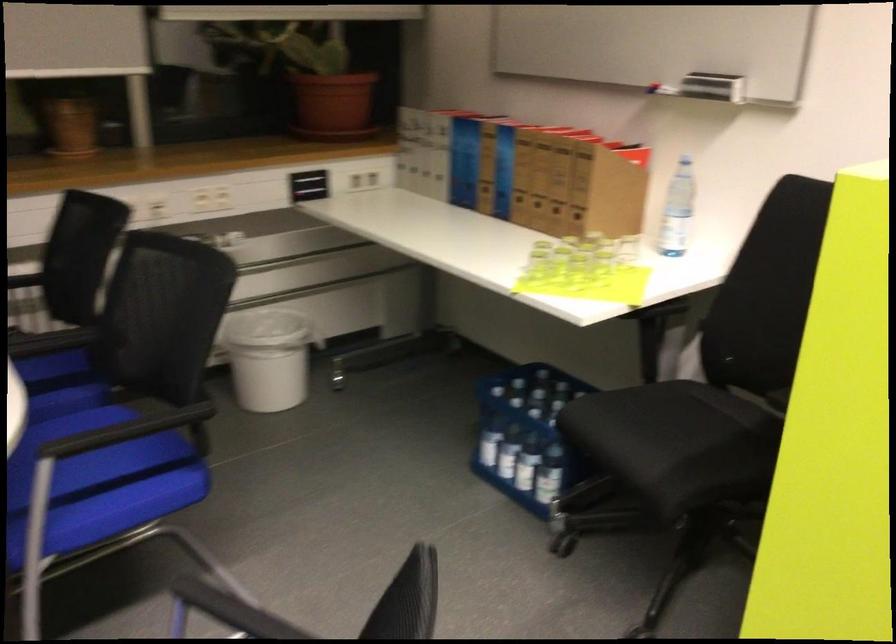
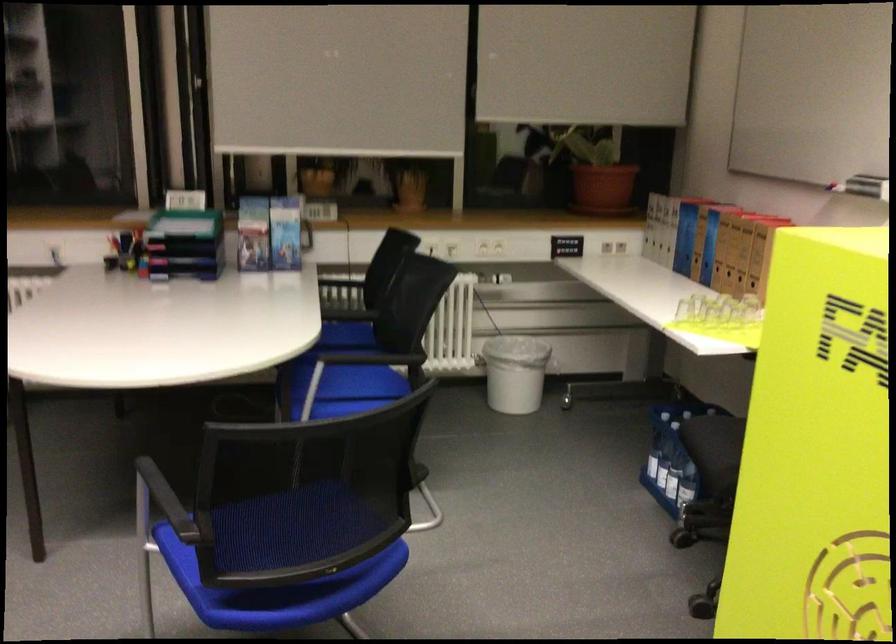
Find the pixel in the second image that matches [536,182] in the first image.

(730, 251)